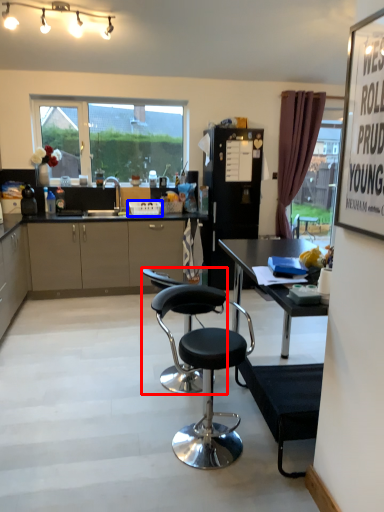
Question: Which object appears closest to the camera in this image, chair (highlighted by a red box) or picnic basket (highlighted by a blue box)?

Choices:
 (A) chair
 (B) picnic basket

Answer: (A)